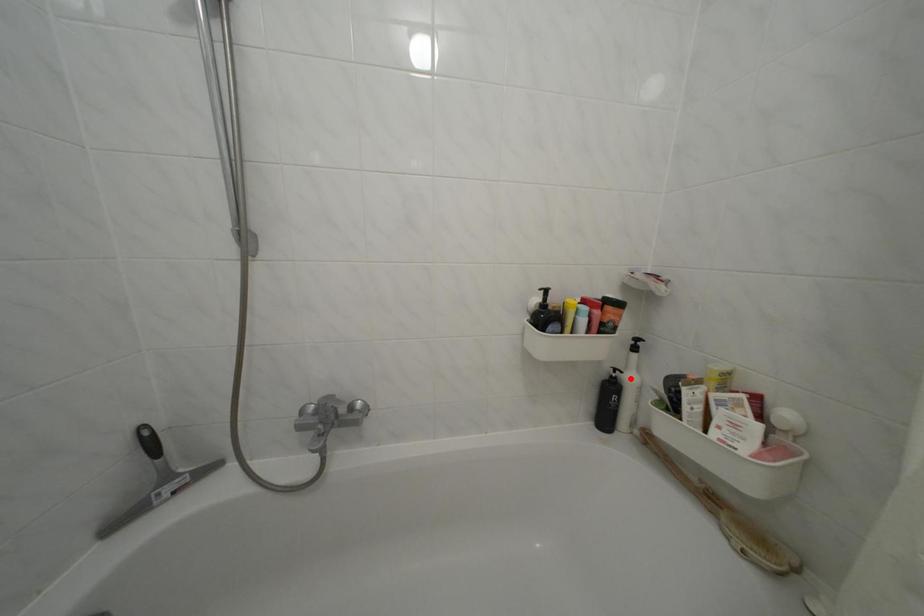
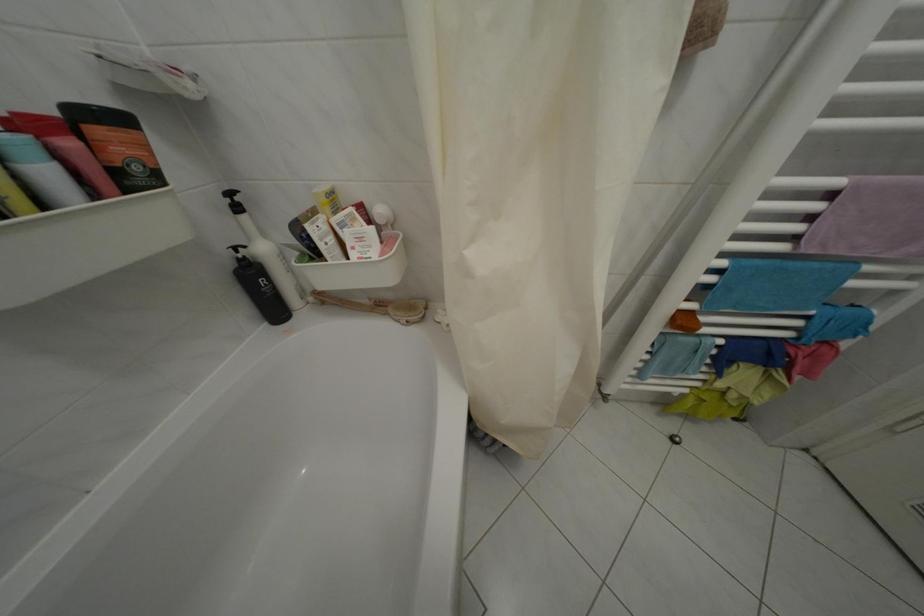
Question: I am providing you with two images of the same scene from different viewpoints. A red point is shown in image1. For the corresponding object point in image2, is it positioned nearer or farther from the camera?

Choices:
 (A) Nearer
 (B) Farther

Answer: (A)